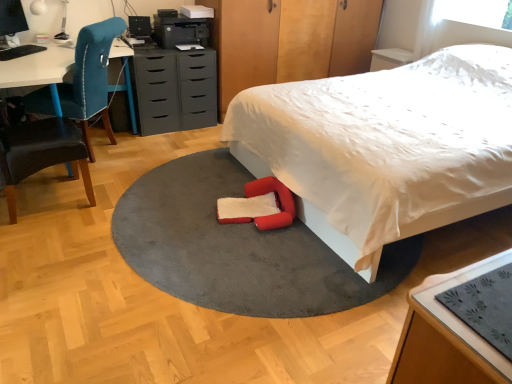
The width and height of the screenshot is (512, 384). Describe the element at coordinates (246, 45) in the screenshot. I see `wooden dresser at upper center` at that location.

Describe the element at coordinates (11, 22) in the screenshot. I see `matte black monitor at upper left` at that location.

The image size is (512, 384). I want to click on soft gray carpet at center, so click(x=238, y=247).

What is the approximate width of matte gray chest of drawers at center?

matte gray chest of drawers at center is 25.27 inches wide.

The image size is (512, 384). I want to click on black matte printer at upper center, so click(179, 29).

Which is closer to the camera, (x=423, y=149) or (x=436, y=371)?

The point (x=436, y=371) is closer.

From a real-world perspective, which object stands above the other?

white soft bed at center.

Considering the sizes of objects white soft bed at center and wooden table at lower right in the image provided, who is thinner, white soft bed at center or wooden table at lower right?

wooden table at lower right.

From the image's perspective, which is above, white soft bed at center or wooden table at lower right?

From the image's view, white soft bed at center is above.

Locate an element on the screen. table lamp that appears above the wooden dresser at upper center (from a real-world perspective) is located at coordinates (63, 23).

Is white glossy table lamp at upper left looking in the opposite direction of wooden dresser at upper center?

No, white glossy table lamp at upper left is not facing away from wooden dresser at upper center.

What's the angular difference between white glossy table lamp at upper left and wooden dresser at upper center's facing directions?

49 degrees separate the facing orientations of white glossy table lamp at upper left and wooden dresser at upper center.

Is wooden dresser at upper center surrounded by white glossy table lamp at upper left?

No, wooden dresser at upper center is not inside white glossy table lamp at upper left.

Is matte gray chest of drawers at center not inside wooden table at lower right?

Absolutely, matte gray chest of drawers at center is external to wooden table at lower right.

Is matte gray chest of drawers at center in contact with wooden table at lower right?

matte gray chest of drawers at center and wooden table at lower right are clearly separated.

Between matte gray chest of drawers at center and wooden table at lower right, which one has larger size?

Bigger between the two is wooden table at lower right.

Looking at this image, could you tell me if matte gray chest of drawers at center is facing wooden table at lower right?

Yes, matte gray chest of drawers at center is oriented towards wooden table at lower right.

Does point (305, 173) appear closer or farther from the camera than point (84, 185)?

Point (305, 173).

What's the angular difference between white soft bed at center and velvet teal chair at left, the 1th chair viewed from the front,'s facing directions?

There is a 176-degree angle between the facing directions of white soft bed at center and velvet teal chair at left, the 1th chair viewed from the front.

Are white soft bed at center and velvet teal chair at left, the second chair when ordered from back to front, making contact?

No, white soft bed at center is not next to velvet teal chair at left, the second chair when ordered from back to front.

From the image's perspective, which is below, white soft bed at center or velvet teal chair at left, the second chair when ordered from back to front?

From the image's view, velvet teal chair at left, the second chair when ordered from back to front, is below.

Visually, is white soft bed at center positioned to the left or to the right of velvet teal chair at left, placed as the second chair when sorted from front to back?

white soft bed at center is positioned on velvet teal chair at left, placed as the second chair when sorted from front to back,'s right side.

How many degrees apart are the facing directions of white soft bed at center and velvet teal chair at left, placed as the second chair when sorted from front to back?

The angular difference between white soft bed at center and velvet teal chair at left, placed as the second chair when sorted from front to back, is 43.4 degrees.

From the image's perspective, between white soft bed at center and velvet teal chair at left, placed as the second chair when sorted from front to back, which one is located above?

velvet teal chair at left, placed as the second chair when sorted from front to back, appears higher in the image.

Based on the photo, considering the sizes of objects white soft bed at center and velvet teal chair at left, placed as the second chair when sorted from front to back, in the image provided, who is wider, white soft bed at center or velvet teal chair at left, placed as the second chair when sorted from front to back,?

With larger width is white soft bed at center.

Which object is positioned more to the left, black matte printer at upper center or velvet teal chair at left, the 1th chair viewed from the front?

velvet teal chair at left, the 1th chair viewed from the front, is more to the left.

Is black matte printer at upper center in contact with velvet teal chair at left, the 1th chair viewed from the front?

No.

Does black matte printer at upper center have a lesser width compared to velvet teal chair at left, the 1th chair viewed from the front?

Yes, black matte printer at upper center is thinner than velvet teal chair at left, the 1th chair viewed from the front.

From a real-world perspective, is black matte printer at upper center over velvet teal chair at left, the 1th chair viewed from the front?

Yes.

Is velvet teal chair at left, the 1th chair viewed from the front, turned away from wooden table at lower right?

No, velvet teal chair at left, the 1th chair viewed from the front,'s orientation is not away from wooden table at lower right.

Would you say velvet teal chair at left, the 1th chair viewed from the front, is outside wooden table at lower right?

Yes.

Is velvet teal chair at left, the second chair when ordered from back to front, in contact with wooden table at lower right?

No, velvet teal chair at left, the second chair when ordered from back to front, is not in contact with wooden table at lower right.

In terms of width, does velvet teal chair at left, the 1th chair viewed from the front, look wider or thinner when compared to wooden table at lower right?

In the image, velvet teal chair at left, the 1th chair viewed from the front, appears to be wider than wooden table at lower right.

Find the location of a particular element. The image size is (512, 384). table to the left of white soft bed at center is located at coordinates (446, 336).

Where is `dresser above the white glossy table lamp at upper left (from the image's perspective)`? This screenshot has height=384, width=512. dresser above the white glossy table lamp at upper left (from the image's perspective) is located at coordinates (246, 45).

Looking at the image, which one is located closer to matte black monitor at upper left, wooden table at lower right or wooden dresser at upper center?

Among the two, wooden dresser at upper center is located nearer to matte black monitor at upper left.

When comparing their distances from matte black monitor at upper left, does black matte printer at upper center or wooden dresser at upper center seem further?

wooden dresser at upper center lies further to matte black monitor at upper left than the other object.

Which object lies nearer to the anchor point wooden table at lower right, black plastic drawer at center or soft gray carpet at center?

soft gray carpet at center.

Considering their positions, is wooden table at lower right positioned closer to red plush bean bag chair at lower center than velvet teal chair at left, which is counted as the 1th chair, starting from the back?

wooden table at lower right is closer to red plush bean bag chair at lower center.

Looking at this image, based on their spatial positions, is black plastic drawer at center or wooden table at lower right further from velvet teal chair at left, placed as the second chair when sorted from front to back?

Based on the image, wooden table at lower right appears to be further to velvet teal chair at left, placed as the second chair when sorted from front to back.

Which object lies nearer to the anchor point wooden table at lower right, black plastic drawer at center or red plush bean bag chair at lower center?

red plush bean bag chair at lower center lies closer to wooden table at lower right than the other object.

Considering their positions, is black matte printer at upper center positioned further to white soft bed at center than black plastic drawer at center?

Among the two, black matte printer at upper center is located further to white soft bed at center.

Based on their spatial positions, is velvet teal chair at left, the 1th chair viewed from the front, or soft gray carpet at center closer to white glossy table lamp at upper left?

The object closer to white glossy table lamp at upper left is velvet teal chair at left, the 1th chair viewed from the front.

This screenshot has width=512, height=384. I want to click on bean bag chair situated between velvet teal chair at left, the 1th chair viewed from the front, and soft gray carpet at center from left to right, so click(x=259, y=205).

This screenshot has width=512, height=384. What are the coordinates of `table lamp located between soft gray carpet at center and black plastic drawer at center in the depth direction` in the screenshot? It's located at click(63, 23).

This screenshot has height=384, width=512. I want to click on mat positioned between white soft bed at center and matte gray chest of drawers at center from near to far, so click(238, 247).

What are the coordinates of `mat located between wooden table at lower right and red plush bean bag chair at lower center in the depth direction` in the screenshot? It's located at (238, 247).